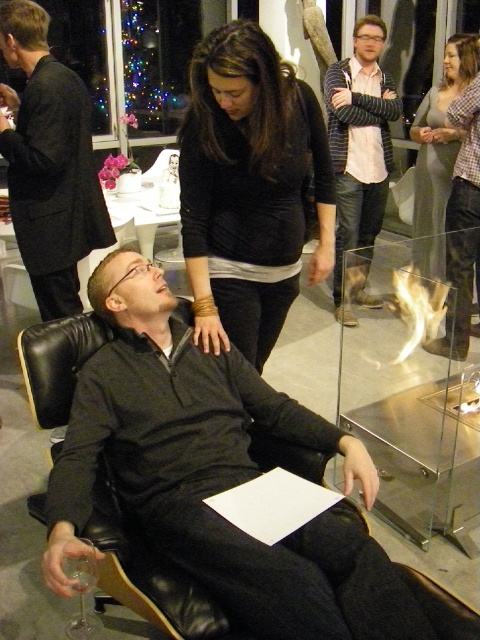
You are an interior designer assessing the layout of this space. You notice the gray sweater at upper right and the clear glass wine glass at lower left. Which object is positioned higher up in the image?

The gray sweater at upper right is positioned higher up in the image than the clear glass wine glass at lower left, as it is taller than the wine glass.

You are organizing a photo shoot and need to place a decorative pillow on the floor next to the matte black jacket at center. According to the image coordinates provided, where should you place the pillow to ensure it is adjacent to the jacket?

The matte black jacket at center is located at point (48,163), so you should place the decorative pillow near those coordinates to ensure it is adjacent.